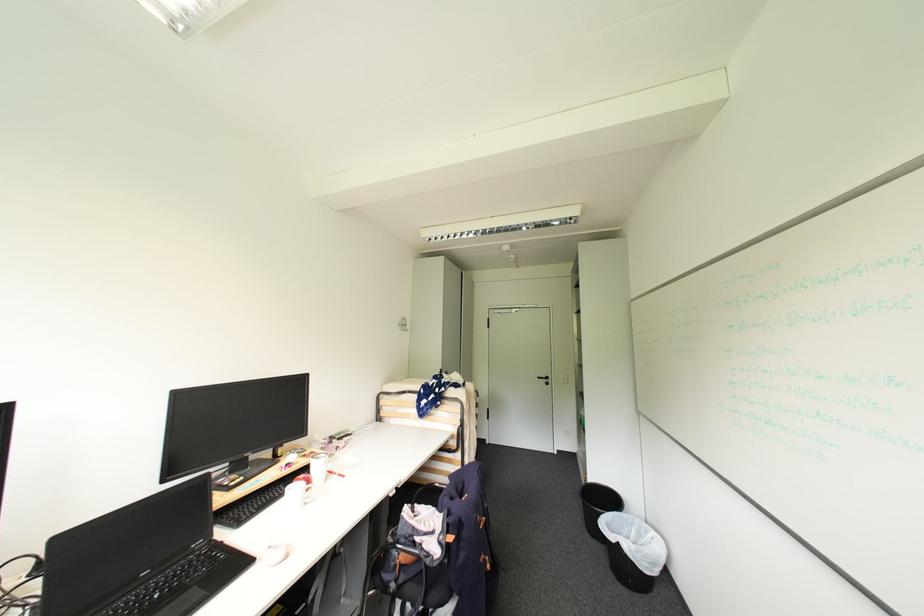
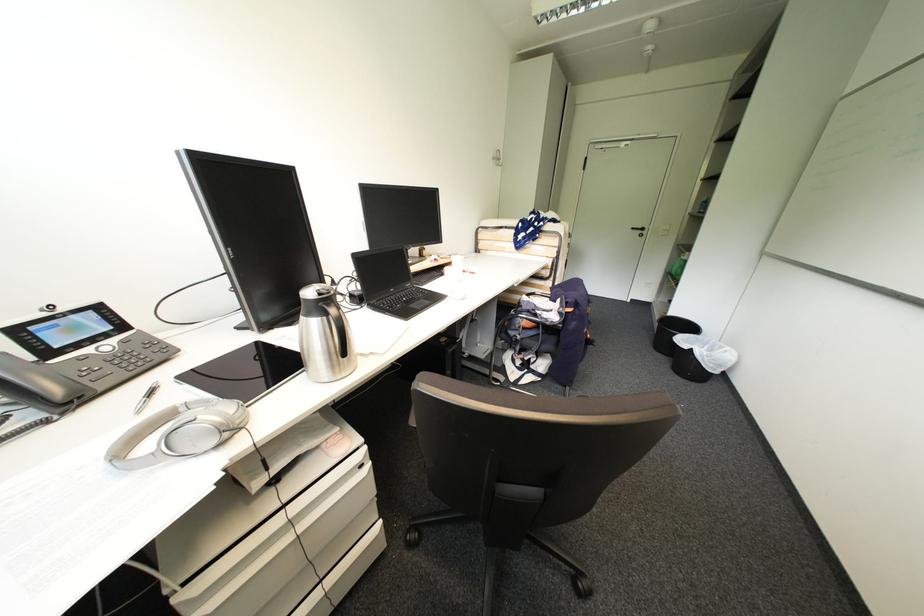
Where in the second image is the point corresponding to point 614,548 from the first image?

(677, 359)